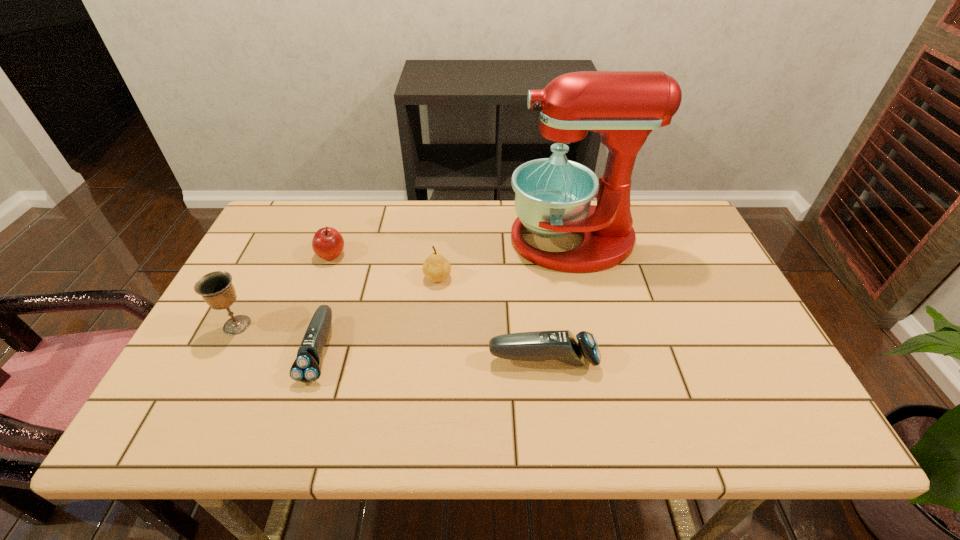
Find the location of a particular element. vacant space positioned 0.240m on the front-facing side of the mixer is located at coordinates (429, 240).

You are a GUI agent. You are given a task and a screenshot of the screen. Output one action in this format:
    pyautogui.click(x=<x>, y=<y>)
    Task: Click on the vacant point located 0.160m on the front-facing side of the mixer
    This screenshot has height=540, width=960.
    Given the screenshot: What is the action you would take?
    pyautogui.click(x=455, y=240)

Locate an element on the screen. blank space located on the right of the second tallest object is located at coordinates (333, 325).

The height and width of the screenshot is (540, 960). Find the location of `vacant space located on the right of the pear`. vacant space located on the right of the pear is located at coordinates (516, 278).

I want to click on vacant region located 0.120m on the front of the apple, so click(317, 296).

Identify the location of mixer located at the far edge. (553, 195).

Where is `apple located in the far edge section of the desktop`? This screenshot has width=960, height=540. apple located in the far edge section of the desktop is located at coordinates (328, 243).

The image size is (960, 540). I want to click on object that is at the left edge, so click(216, 288).

Locate an element on the screen. vacant position at the far edge of the desktop is located at coordinates (435, 208).

Find the location of `blank space at the near edge of the desktop`. blank space at the near edge of the desktop is located at coordinates (343, 379).